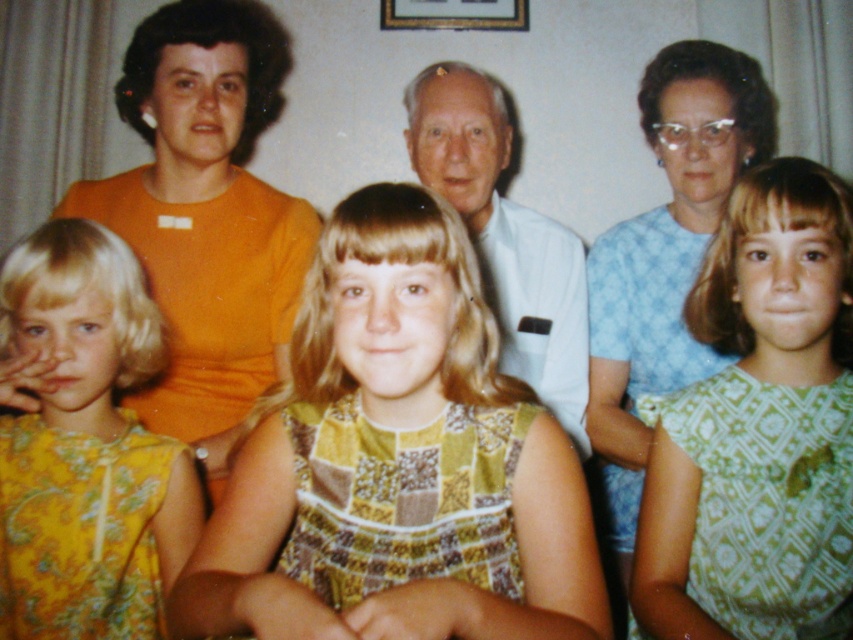
Question: Is green printed dress at center to the right of gold/golden wood picture frame at upper center from the viewer's perspective?

Choices:
 (A) yes
 (B) no

Answer: (A)

Question: Does green printed dress at center lie in front of white smooth shirt at center?

Choices:
 (A) yes
 (B) no

Answer: (A)

Question: Is patterned fabric dress at center bigger than white smooth shirt at center?

Choices:
 (A) no
 (B) yes

Answer: (B)

Question: Estimate the real-world distances between objects in this image. Which object is closer to the white smooth shirt at center?

Choices:
 (A) patterned fabric dress at center
 (B) gold/golden wood picture frame at upper center

Answer: (A)

Question: Among these points, which one is nearest to the camera?

Choices:
 (A) (138, 330)
 (B) (700, 403)
 (C) (492, 93)

Answer: (B)

Question: Based on their relative distances, which object is nearer to the yellow floral dress at left?

Choices:
 (A) patterned fabric dress at center
 (B) white smooth shirt at center
 (C) gold/golden wood picture frame at upper center

Answer: (A)